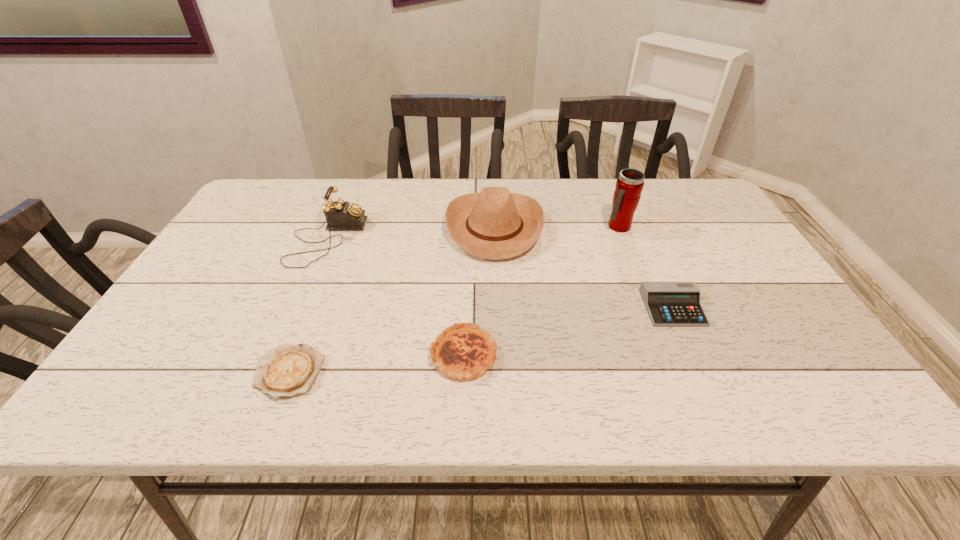
Identify the location of free space that satisfies the following two spatial constraints: 1. on the dial of the telephone; 2. on the right side of the fourth farthest object. (298, 308).

Find the location of a particular element. Image resolution: width=960 pixels, height=540 pixels. free space that satisfies the following two spatial constraints: 1. on the back side of the fourth farthest object; 2. on the dial of the telephone is located at coordinates (641, 239).

Find the location of `free space in the image that satisfies the following two spatial constraints: 1. on the dial of the telephone; 2. on the left side of the shortest object`. free space in the image that satisfies the following two spatial constraints: 1. on the dial of the telephone; 2. on the left side of the shortest object is located at coordinates (270, 373).

Locate an element on the screen. This screenshot has height=540, width=960. free space that satisfies the following two spatial constraints: 1. on the front-facing side of the cowboy hat; 2. on the back side of the third nearest object is located at coordinates (498, 308).